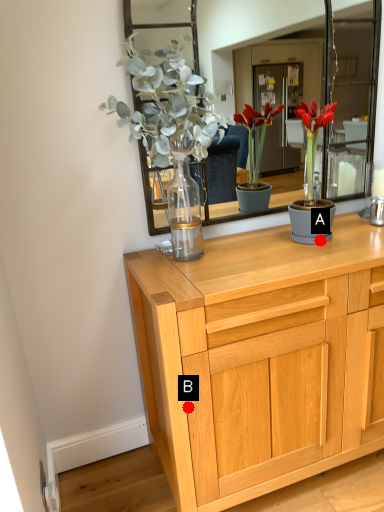
Question: Two points are circled on the image, labeled by A and B beside each circle. Among these points, which one is nearest to the camera?

Choices:
 (A) A is closer
 (B) B is closer

Answer: (B)